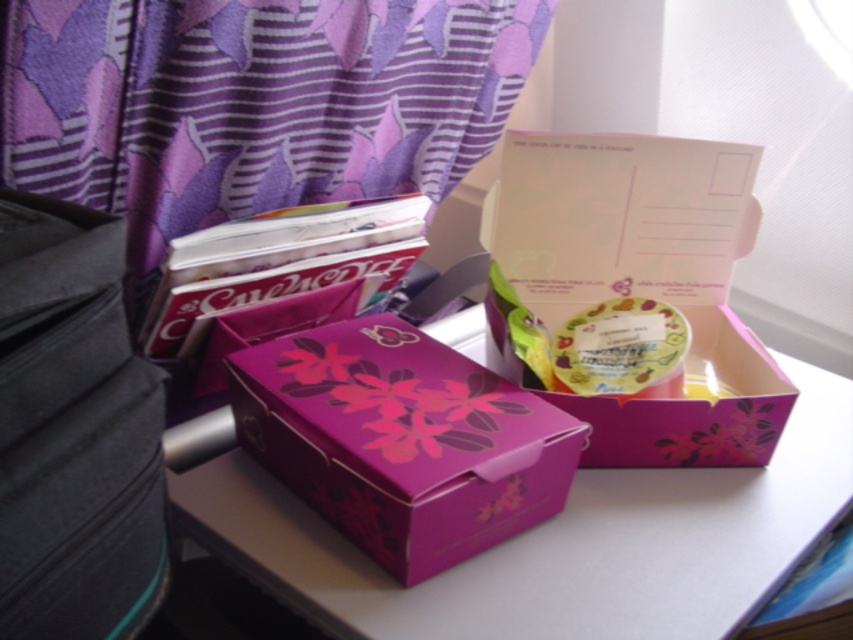
You are organizing items on a desk and notice the purple fabric curtain at upper left and the purple cardboard box at center. Which object is taller?

The purple fabric curtain at upper left is taller than the purple cardboard box at center.

Looking at this image, you are organizing items on a desk and need to place a new item exactly at the point marked by the coordinates. What object is located at the coordinates point (560, 541)?

The point (560, 541) indicates the purple cardboard box at center.

What is located at the point with coordinates (251, 104) on the image?

The purple fabric curtain at upper left is located at point (251, 104).